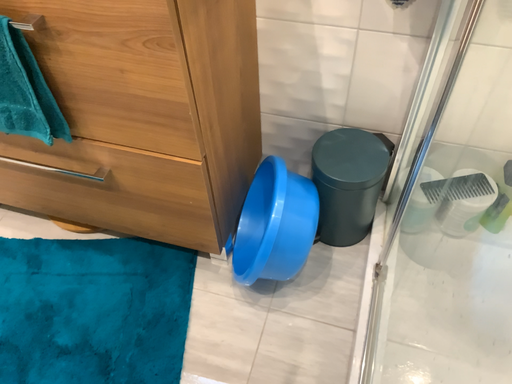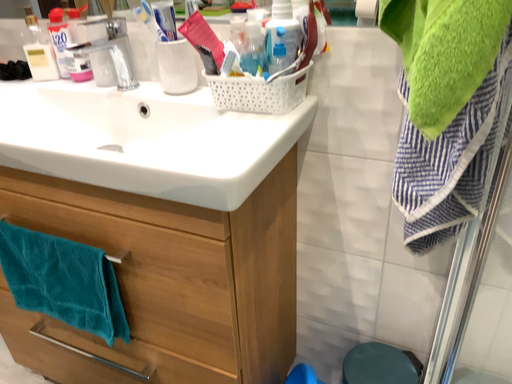
Question: Which way did the camera rotate in the video?

Choices:
 (A) rotated upward
 (B) rotated downward

Answer: (A)